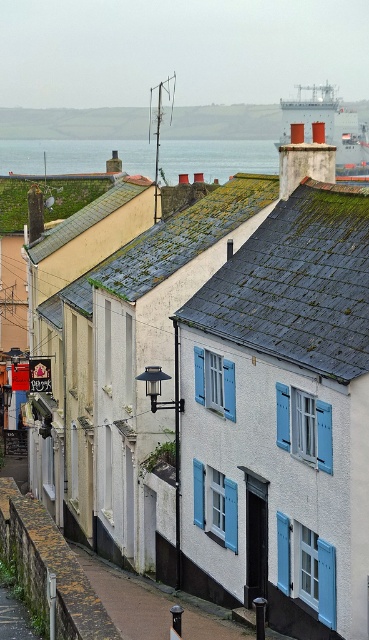
Between blue-green water at upper center and smooth concrete wall at upper center, which one is positioned lower?

blue-green water at upper center is below.

The width and height of the screenshot is (369, 640). What do you see at coordinates (74, 156) in the screenshot?
I see `blue-green water at upper center` at bounding box center [74, 156].

The image size is (369, 640). What do you see at coordinates (74, 156) in the screenshot?
I see `blue-green water at upper center` at bounding box center [74, 156].

Locate an element on the screen. blue-green water at upper center is located at coordinates (74, 156).

Does smooth concrete wall at upper center have a lesser height compared to metallic gray ship at upper center?

Yes.

Who is shorter, smooth concrete wall at upper center or metallic gray ship at upper center?

smooth concrete wall at upper center is shorter.

Based on the photo, measure the distance between point (132, 120) and camera.

Point (132, 120) is 993.34 feet from camera.

Where is `smooth concrete wall at upper center`? smooth concrete wall at upper center is located at coordinates (74, 124).

Does point (39, 172) come closer to viewer compared to point (285, 116)?

Yes, point (39, 172) is in front of point (285, 116).

Which is below, blue-green water at upper center or metallic gray ship at upper center?

metallic gray ship at upper center is below.

Which is behind, point (345, 161) or point (339, 141)?

The point (345, 161) is behind.

Image resolution: width=369 pixels, height=640 pixels. What are the coordinates of `blue-green water at upper center` in the screenshot? It's located at (74, 156).